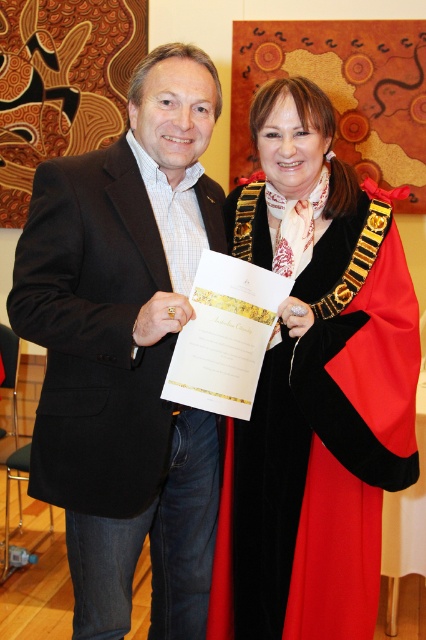
Question: Is black matte suit at center to the left of velvet black coat at center from the viewer's perspective?

Choices:
 (A) no
 (B) yes

Answer: (B)

Question: Which object appears farthest from the camera in this image?

Choices:
 (A) black matte suit at center
 (B) velvet black coat at center

Answer: (B)

Question: Does black matte suit at center come in front of velvet black coat at center?

Choices:
 (A) no
 (B) yes

Answer: (B)

Question: Does black matte suit at center appear under velvet black coat at center?

Choices:
 (A) no
 (B) yes

Answer: (B)